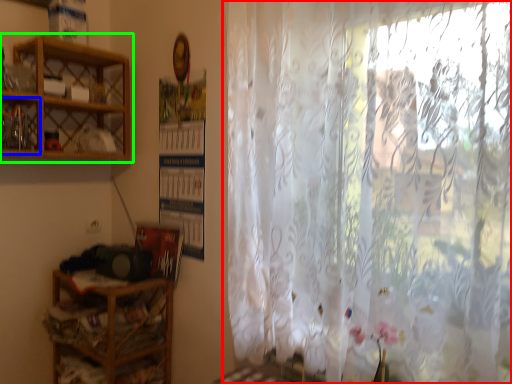
Question: Which is nearer to the curtain (highlighted by a red box)? cabinet (highlighted by a blue box) or shelf (highlighted by a green box).

Choices:
 (A) cabinet
 (B) shelf

Answer: (B)